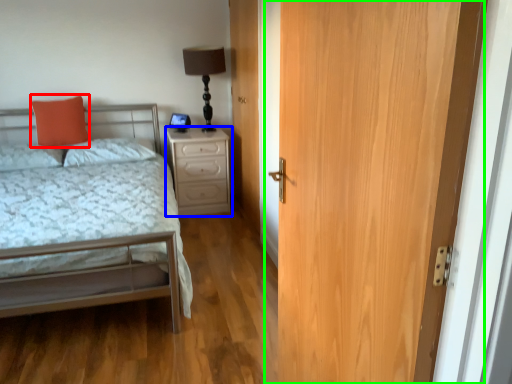
Question: Which object is positioned farthest from pillow (highlighted by a red box)? Select from nightstand (highlighted by a blue box) and door (highlighted by a green box).

Choices:
 (A) nightstand
 (B) door

Answer: (B)